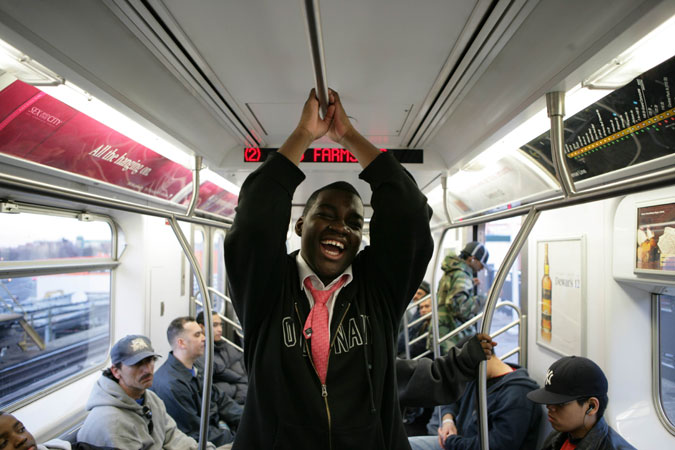
You are a GUI agent. You are given a task and a screenshot of the screen. Output one action in this format:
    pyautogui.click(x=<x>, y=<y>)
    Task: Click on the digital sign
    Image resolution: width=675 pixels, height=450 pixels.
    Given the screenshot: What is the action you would take?
    pyautogui.click(x=327, y=151)